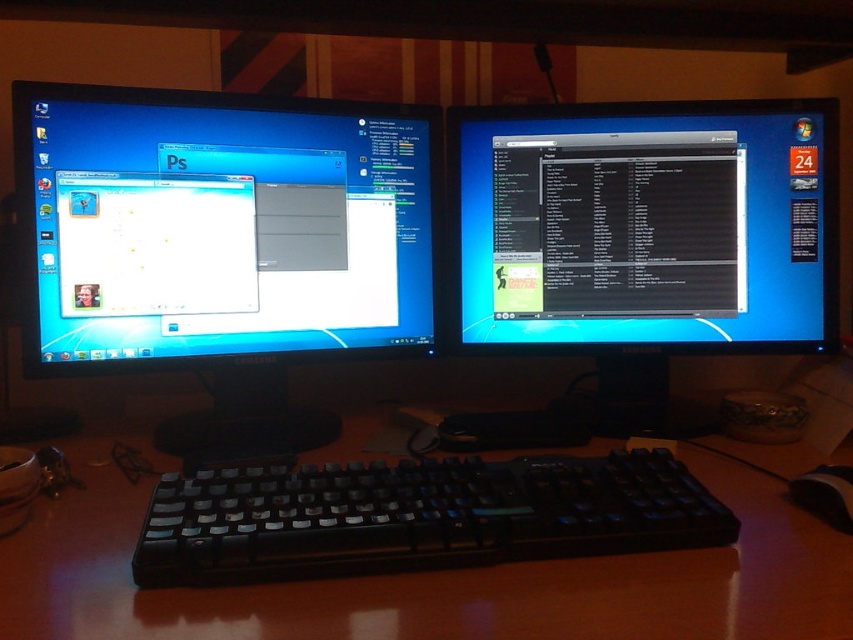
You are a photographer adjusting the camera settings on the left monitor displaying Adobe Photoshop. You notice two points in the image at coordinates point (225, 429) and point (506, 234). Which point is nearer to you?

Point (225, 429) is closer to the viewer than point (506, 234).

You are organizing your workspace and want to place a new wireless charger between the brown wooden computer desk at center and the black matte text editor at center. Based on their positions, where should you place the charger so it is closer to the desk?

The brown wooden computer desk at center is to the left of the black matte text editor at center, so placing the wireless charger to the left side between them would position it closer to the desk.

You are setting up a new computer desk in your home office. You want to place it exactly where the brown wooden computer desk at center is located in the image. What are the coordinates you should input into your room planner to position it correctly?

The coordinates for the brown wooden computer desk at center are 0.905 on the x axis and 0.506 on the y axis.